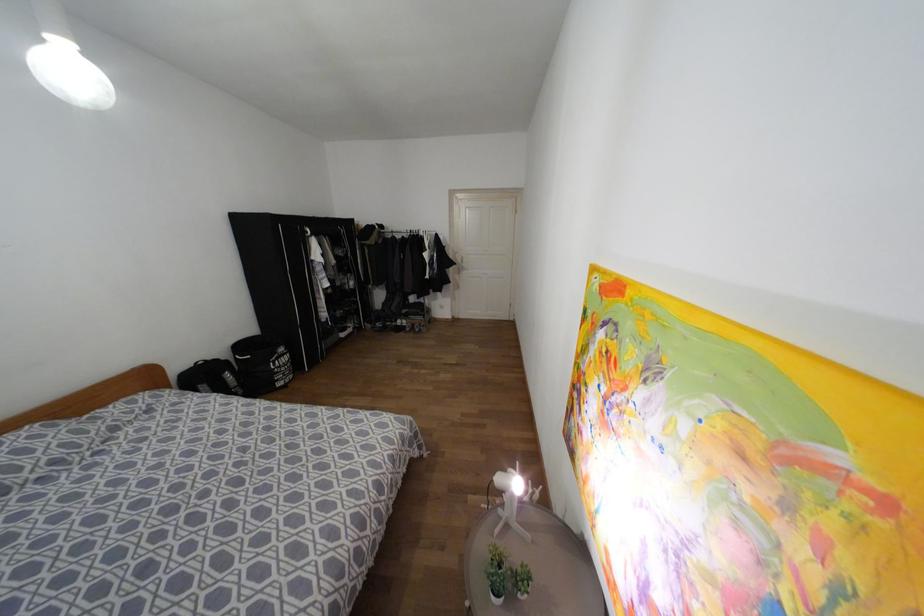
Find the location of a particular element. Image resolution: width=924 pixels, height=616 pixels. wardrobe zipper pull is located at coordinates (416, 233).